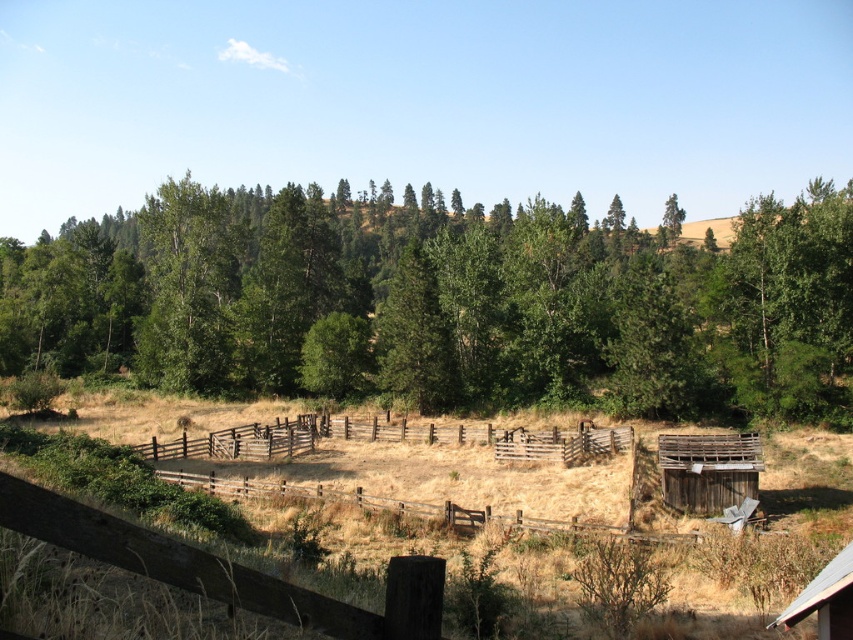
You are standing in the rural landscape and want to walk from the point at coordinates point (231,432) to the point at coordinates point (813,596). Which direction should you move relative to your current position?

You should move away from the camera because point (813,596) is closer to the camera than point (231,432), so moving towards it would mean moving in the direction away from your current position.

You are a farmer checking the height of structures in your farm. You see the wooden fence at center and the rusty wooden barn at lower right. Which structure is taller?

The wooden fence at center is not as tall as the rusty wooden barn at lower right, so the rusty wooden barn at lower right is taller.

You are a farmer planning to plant a new row of crops between the green matte tree at center and the metallic silver barn at lower right. Based on their widths, which object should you consider for spacing requirements?

The green matte tree at center might be wider than the metallic silver barn at lower right, so you should consider the tree for spacing requirements to ensure enough space for growth and access.